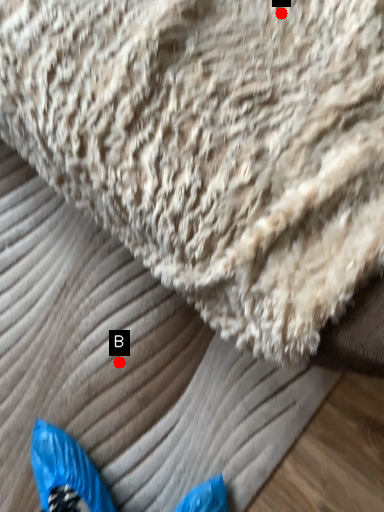
Question: Two points are circled on the image, labeled by A and B beside each circle. Which point appears closest to the camera in this image?

Choices:
 (A) A is closer
 (B) B is closer

Answer: (A)